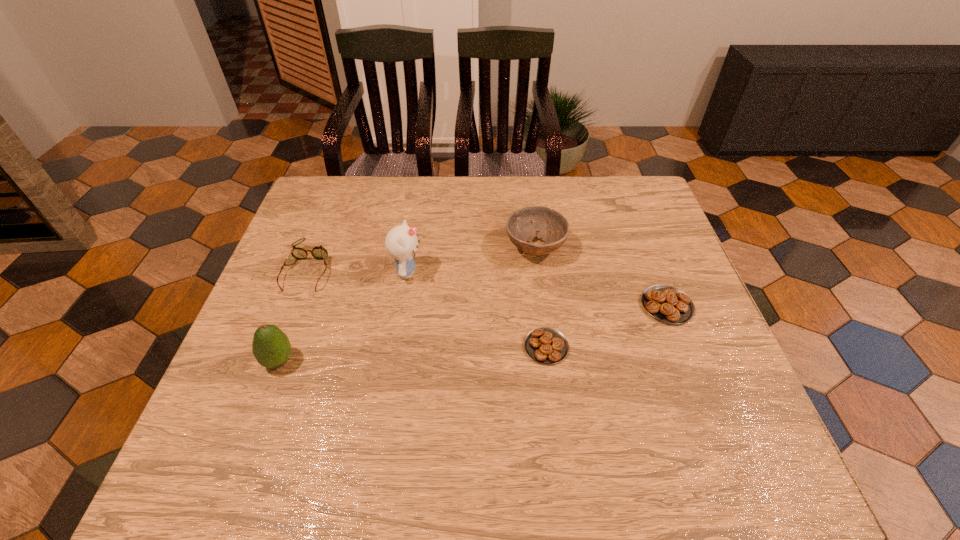
Where is `free space at the left edge`? free space at the left edge is located at coordinates (311, 290).

Find the location of a particular element. The image size is (960, 540). vacant space at the right edge of the desktop is located at coordinates (637, 262).

I want to click on blank space at the far left corner, so click(328, 223).

This screenshot has height=540, width=960. Identify the location of vacant region at the far right corner of the desktop. (642, 201).

You are a GUI agent. You are given a task and a screenshot of the screen. Output one action in this format:
    pyautogui.click(x=<x>, y=<y>)
    Task: Click on the free space between the second tallest object and the kitten
    The width and height of the screenshot is (960, 540).
    Given the screenshot: What is the action you would take?
    pyautogui.click(x=343, y=316)

Locate an element on the screen. The height and width of the screenshot is (540, 960). empty location between the fourth tallest object and the third object from left to right is located at coordinates (357, 270).

Locate an element on the screen. Image resolution: width=960 pixels, height=540 pixels. vacant space that's between the avocado and the third object from left to right is located at coordinates (343, 316).

This screenshot has width=960, height=540. I want to click on empty location between the bowl and the rightmost object, so click(601, 276).

Identify the location of vacant space that is in between the avocado and the shortest object. This screenshot has width=960, height=540. (413, 354).

You are a GUI agent. You are given a task and a screenshot of the screen. Output one action in this format:
    pyautogui.click(x=<x>, y=<y>)
    Task: Click on the vacant area that lies between the kitten and the third shortest object
    This screenshot has width=960, height=540.
    Given the screenshot: What is the action you would take?
    pyautogui.click(x=357, y=270)